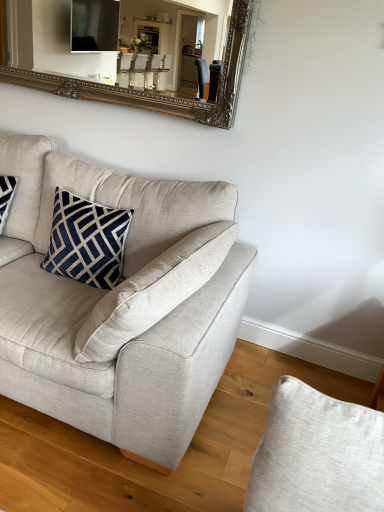
Question: Is silver/gilded mirror at upper center smaller than navy blue fabric pillow at upper left?

Choices:
 (A) yes
 (B) no

Answer: (B)

Question: From the image's perspective, would you say silver/gilded mirror at upper center is shown under navy blue fabric pillow at upper left?

Choices:
 (A) yes
 (B) no

Answer: (B)

Question: Is silver/gilded mirror at upper center outside navy blue fabric pillow at upper left?

Choices:
 (A) yes
 (B) no

Answer: (A)

Question: Can you confirm if silver/gilded mirror at upper center is taller than navy blue fabric pillow at upper left?

Choices:
 (A) yes
 (B) no

Answer: (A)

Question: Does silver/gilded mirror at upper center contain navy blue fabric pillow at upper left?

Choices:
 (A) yes
 (B) no

Answer: (B)

Question: From a real-world perspective, relative to silver/gilded mirror at upper center, is navy blue fabric pillow at upper left vertically above or below?

Choices:
 (A) below
 (B) above

Answer: (A)

Question: From the image's perspective, relative to silver/gilded mirror at upper center, is navy blue fabric pillow at upper left above or below?

Choices:
 (A) below
 (B) above

Answer: (A)

Question: Considering the positions of point (79, 266) and point (92, 65), is point (79, 266) closer or farther from the camera than point (92, 65)?

Choices:
 (A) closer
 (B) farther

Answer: (A)

Question: In the image, is navy blue fabric pillow at upper left positioned in front of or behind silver/gilded mirror at upper center?

Choices:
 (A) behind
 (B) front

Answer: (B)

Question: Looking at the image, does silver/gilded mirror at upper center seem bigger or smaller compared to light beige fabric couch at center?

Choices:
 (A) big
 (B) small

Answer: (B)

Question: From a real-world perspective, relative to light beige fabric couch at center, is silver/gilded mirror at upper center vertically above or below?

Choices:
 (A) below
 (B) above

Answer: (B)

Question: Considering the positions of silver/gilded mirror at upper center and light beige fabric couch at center in the image, is silver/gilded mirror at upper center taller or shorter than light beige fabric couch at center?

Choices:
 (A) short
 (B) tall

Answer: (A)

Question: Is silver/gilded mirror at upper center wider or thinner than light beige fabric couch at center?

Choices:
 (A) wide
 (B) thin

Answer: (B)

Question: Based on their sizes in the image, would you say light beige fabric couch at center is bigger or smaller than silver/gilded mirror at upper center?

Choices:
 (A) big
 (B) small

Answer: (A)

Question: Which is correct: light beige fabric couch at center is inside silver/gilded mirror at upper center, or outside of it?

Choices:
 (A) inside
 (B) outside

Answer: (B)